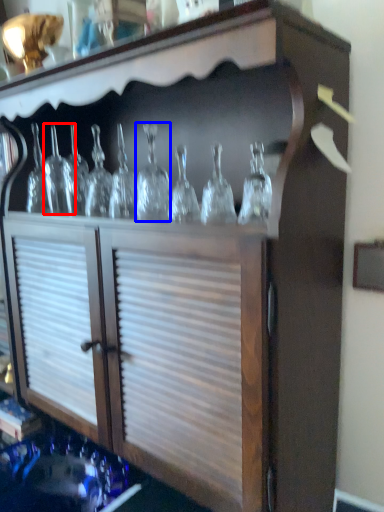
Question: Among these objects, which one is nearest to the camera, glass bottle (highlighted by a red box) or glass bottle (highlighted by a blue box)?

Choices:
 (A) glass bottle
 (B) glass bottle

Answer: (B)